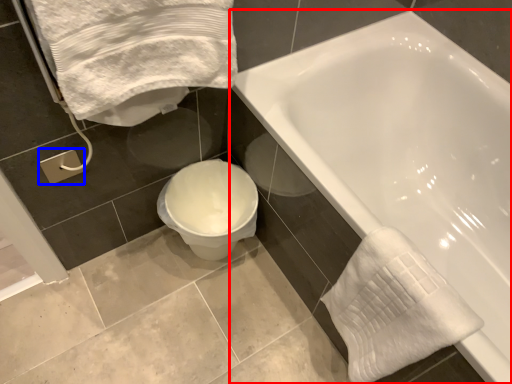
Question: Which object appears closest to the camera in this image, bathtub (highlighted by a red box) or towel bar (highlighted by a blue box)?

Choices:
 (A) bathtub
 (B) towel bar

Answer: (A)